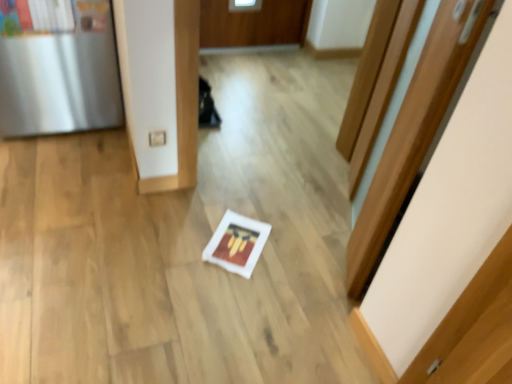
What are the coordinates of `vacant space in wooden door at center (from a real-world perspective)` in the screenshot? It's located at (339, 221).